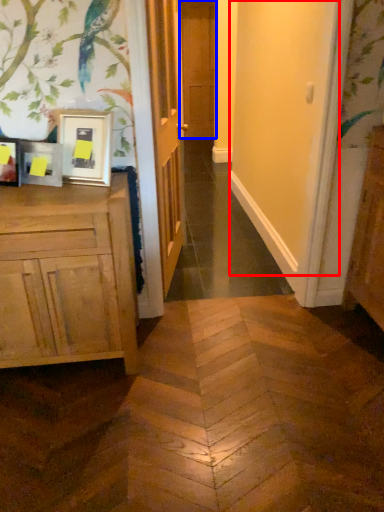
Question: Among these objects, which one is farthest to the camera, screen door (highlighted by a red box) or door (highlighted by a blue box)?

Choices:
 (A) screen door
 (B) door

Answer: (B)